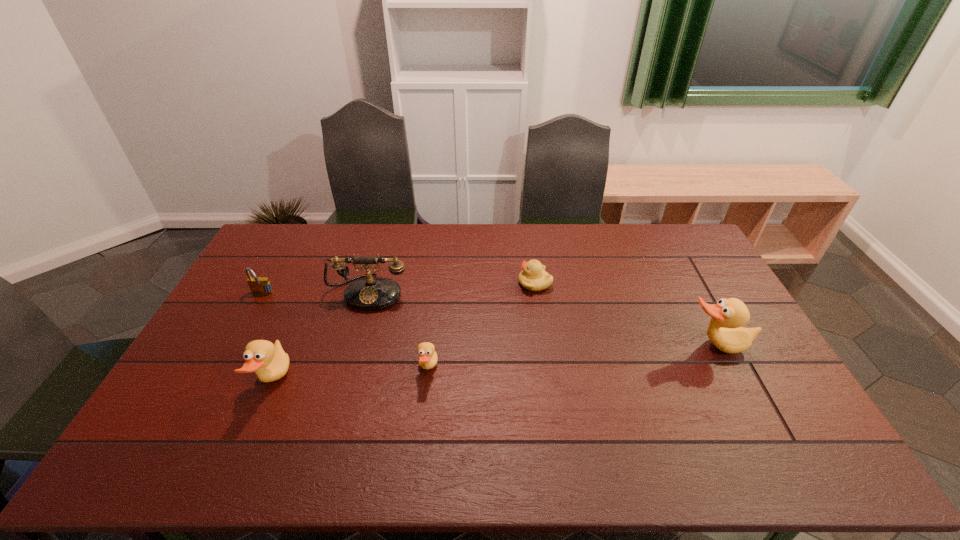
Identify the location of free spot at the near edge of the desktop. (707, 400).

At what (x,y) coordinates should I click in order to perform the action: click on free space at the left edge of the desktop. Please return your answer as a coordinate pair (x, y). The width and height of the screenshot is (960, 540). Looking at the image, I should click on (170, 396).

Identify the location of vacant space at the near right corner. (763, 408).

At what (x,y) coordinates should I click in order to perform the action: click on free point between the leftmost object and the second object from left to right. Please return your answer as a coordinate pair (x, y). Looking at the image, I should click on (268, 338).

Identify the location of vacant area that lies between the rightmost duck and the shortest duck. (572, 357).

Locate an element on the screen. Image resolution: width=960 pixels, height=540 pixels. vacant point located between the duckling and the leftmost duck is located at coordinates (404, 332).

Locate an element on the screen. vacant area between the second object from right to left and the telephone is located at coordinates (452, 288).

Locate an element on the screen. unoccupied position between the shortest duck and the rightmost object is located at coordinates (572, 357).

Locate an element on the screen. The image size is (960, 540). empty location between the second duck from left to right and the fourth object from right to left is located at coordinates (398, 330).

I want to click on vacant space that is in between the second shortest duck and the fifth object from left to right, so click(x=404, y=332).